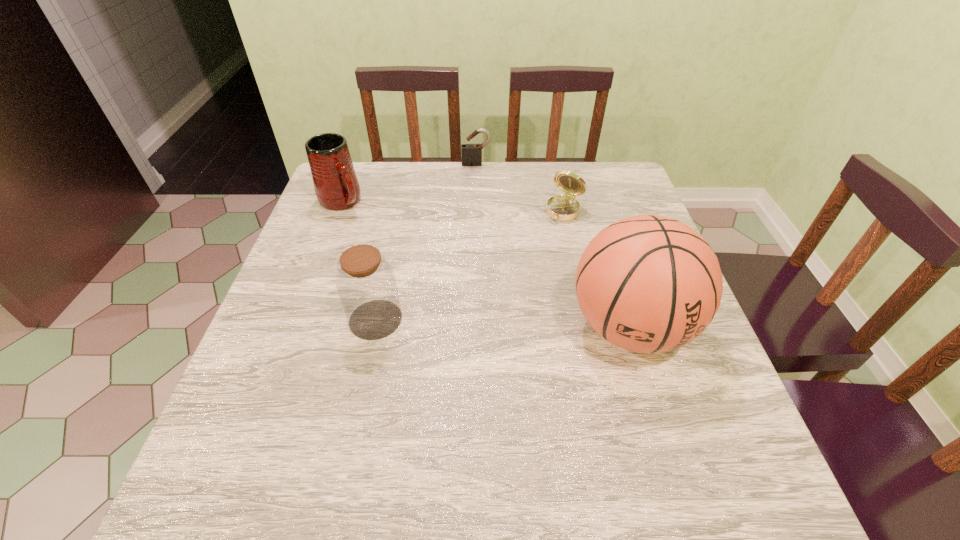
The width and height of the screenshot is (960, 540). I want to click on vacant region located with the dial facing the compass, so click(517, 275).

Find the location of `free spot located with the keyhole on the front of the farthest object`. free spot located with the keyhole on the front of the farthest object is located at coordinates tap(479, 198).

Where is `vacant space located with the keyhole on the front of the farthest object`? vacant space located with the keyhole on the front of the farthest object is located at coordinates (478, 179).

You are a GUI agent. You are given a task and a screenshot of the screen. Output one action in this format:
    pyautogui.click(x=<x>, y=<y>)
    Task: Click on the vacant space situated with the keyhole on the front of the farthest object
    
    Given the screenshot: What is the action you would take?
    pyautogui.click(x=479, y=194)

Where is `vacant position located 0.080m on the side of the leftmost object with the handle`? vacant position located 0.080m on the side of the leftmost object with the handle is located at coordinates (368, 227).

Image resolution: width=960 pixels, height=540 pixels. What are the coordinates of `free space located on the side of the leftmost object with the handle` in the screenshot? It's located at pos(437,289).

Locate an element on the screen. The image size is (960, 540). free point located 0.070m on the side of the leftmost object with the handle is located at coordinates (366, 225).

What are the coordinates of `compass at the far edge` in the screenshot? It's located at (563, 208).

Locate an element on the screen. Image resolution: width=960 pixels, height=540 pixels. padlock positioned at the far edge is located at coordinates (471, 154).

The width and height of the screenshot is (960, 540). I want to click on mug present at the far edge, so click(336, 185).